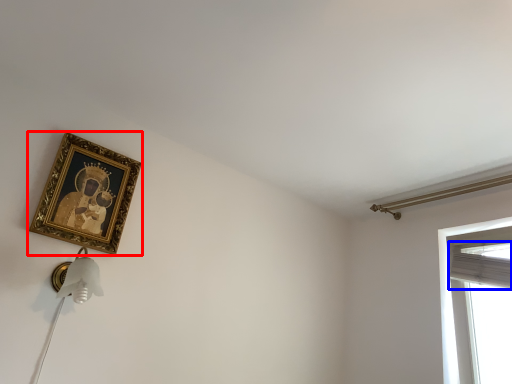
Question: Among these objects, which one is nearest to the camera, picture frame (highlighted by a red box) or curtain (highlighted by a blue box)?

Choices:
 (A) picture frame
 (B) curtain

Answer: (A)